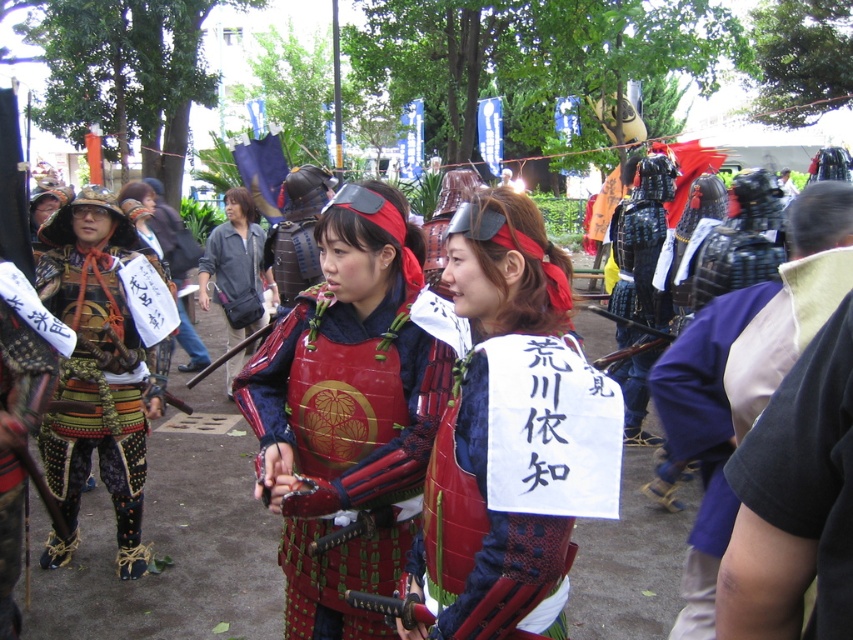
Question: Where is black fabric shirt at right located in relation to red lacquered armor at center in the image?

Choices:
 (A) below
 (B) above

Answer: (A)

Question: Which point appears closest to the camera in this image?

Choices:
 (A) (178, 273)
 (B) (628, 424)
 (C) (701, 432)

Answer: (C)

Question: Which point is closer to the camera?

Choices:
 (A) denim jacket at center
 (B) red lacquered armor at center
 (C) black fabric shirt at right

Answer: (C)

Question: Can you confirm if black fabric shirt at right is bigger than shiny black armor at center-right?

Choices:
 (A) yes
 (B) no

Answer: (B)

Question: Is gold metallic armor at left to the right of red lacquered armor at center from the viewer's perspective?

Choices:
 (A) no
 (B) yes

Answer: (B)

Question: Which object is positioned farthest from the black fabric shirt at right?

Choices:
 (A) gold metallic armor at left
 (B) matte red samurai armor at center
 (C) dark purple fabric at center
 (D) shiny black armor at center-right

Answer: (D)